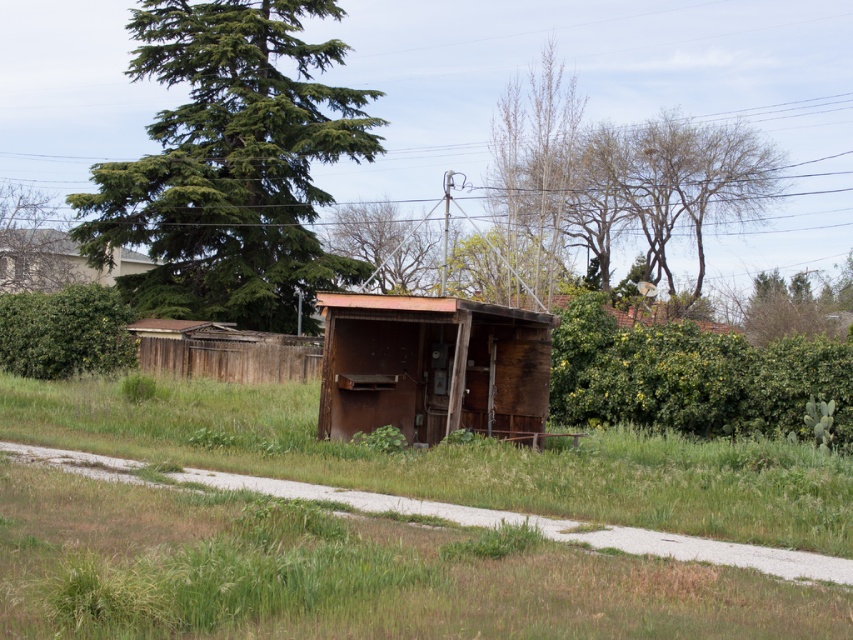
Is bare wood tree at upper right above green leafy tree at upper center?

Indeed, bare wood tree at upper right is positioned over green leafy tree at upper center.

From the picture: Which is more to the left, bare wood tree at upper right or green leafy tree at upper center?

green leafy tree at upper center

Find the location of a particular element. Image resolution: width=853 pixels, height=640 pixels. bare wood tree at upper right is located at coordinates (691, 182).

Measure the distance between weathered wood hut at center and bare wood tree at upper right.

weathered wood hut at center and bare wood tree at upper right are 129.17 feet apart.

Who is more distant from viewer, (416, 360) or (672, 163)?

The point (672, 163) is behind.

Locate an element on the screen. weathered wood hut at center is located at coordinates (430, 365).

Who is positioned more to the left, weathered wood hut at center or green leafy tree at upper left?

Positioned to the left is green leafy tree at upper left.

Image resolution: width=853 pixels, height=640 pixels. What do you see at coordinates (430, 365) in the screenshot? I see `weathered wood hut at center` at bounding box center [430, 365].

This screenshot has height=640, width=853. I want to click on weathered wood hut at center, so click(x=430, y=365).